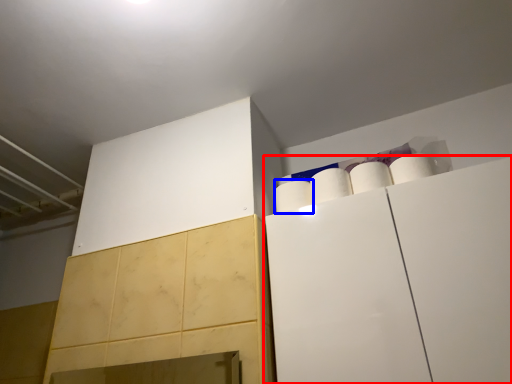
Question: Among these objects, which one is farthest to the camera, cabinetry (highlighted by a red box) or paper towel (highlighted by a blue box)?

Choices:
 (A) cabinetry
 (B) paper towel

Answer: (B)